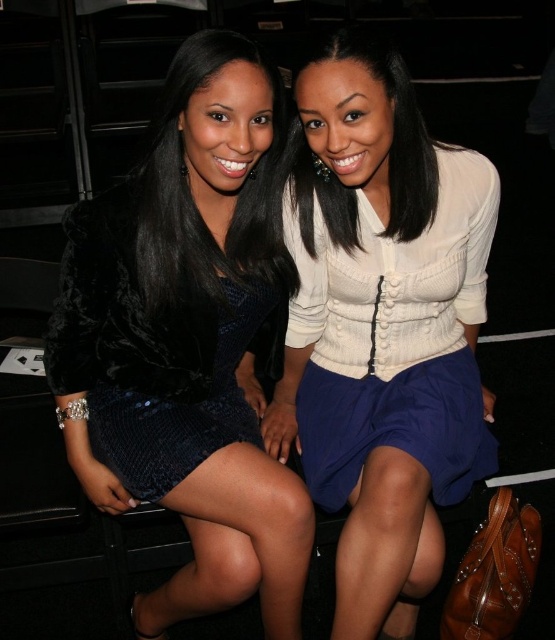
Question: Which point is closer to the camera?

Choices:
 (A) (435, 177)
 (B) (260, 486)

Answer: (B)

Question: Does black sequined dress at center appear under velvet black dress at center?

Choices:
 (A) no
 (B) yes

Answer: (B)

Question: Can you confirm if velvet black dress at left is positioned above white knit cardigan at center?

Choices:
 (A) yes
 (B) no

Answer: (B)

Question: Which of these objects is positioned farthest from the velvet black dress at center?

Choices:
 (A) white knit cardigan at center
 (B) black sequined dress at center
 (C) velvet black dress at left

Answer: (A)

Question: Considering the relative positions of velvet black dress at center and satin white blouse at center in the image provided, where is velvet black dress at center located with respect to satin white blouse at center?

Choices:
 (A) above
 (B) below

Answer: (B)

Question: Which point is farther to the camera?

Choices:
 (A) (210, 324)
 (B) (104, 240)
 (C) (238, 52)

Answer: (A)